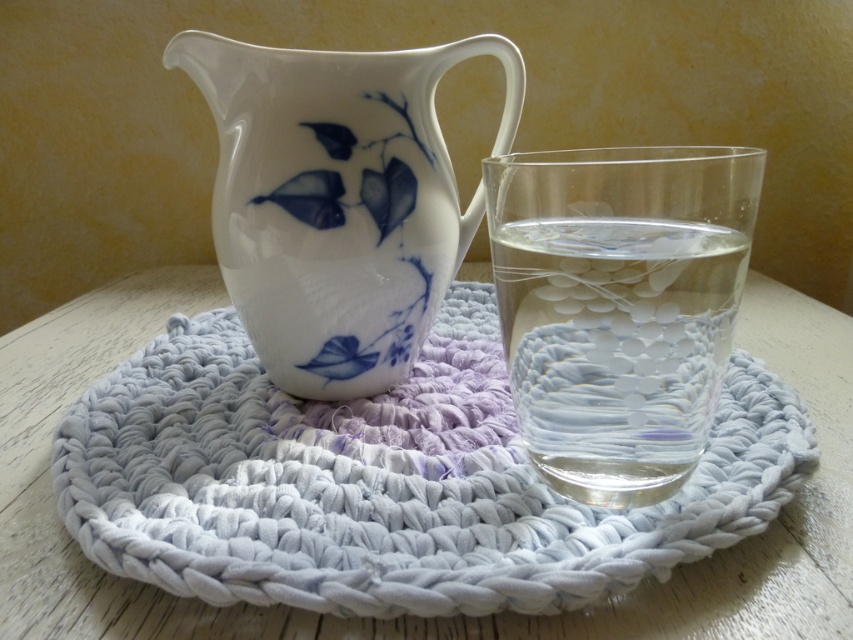
Question: Does white knitted coaster at center lie behind white porcelain jug at center?

Choices:
 (A) no
 (B) yes

Answer: (A)

Question: Does white porcelain jug at center appear under transparent glass water at center?

Choices:
 (A) yes
 (B) no

Answer: (B)

Question: Is the position of white knitted coaster at center more distant than that of white porcelain jug at center?

Choices:
 (A) no
 (B) yes

Answer: (A)

Question: Considering the real-world distances, which object is closest to the transparent glass water at center?

Choices:
 (A) white porcelain jug at center
 (B) white knitted coaster at center

Answer: (A)

Question: Estimate the real-world distances between objects in this image. Which object is closer to the transparent glass water at center?

Choices:
 (A) white knitted coaster at center
 (B) white porcelain jug at center

Answer: (B)

Question: Which object is the closest to the transparent glass water at center?

Choices:
 (A) white knitted coaster at center
 (B) white porcelain jug at center

Answer: (B)